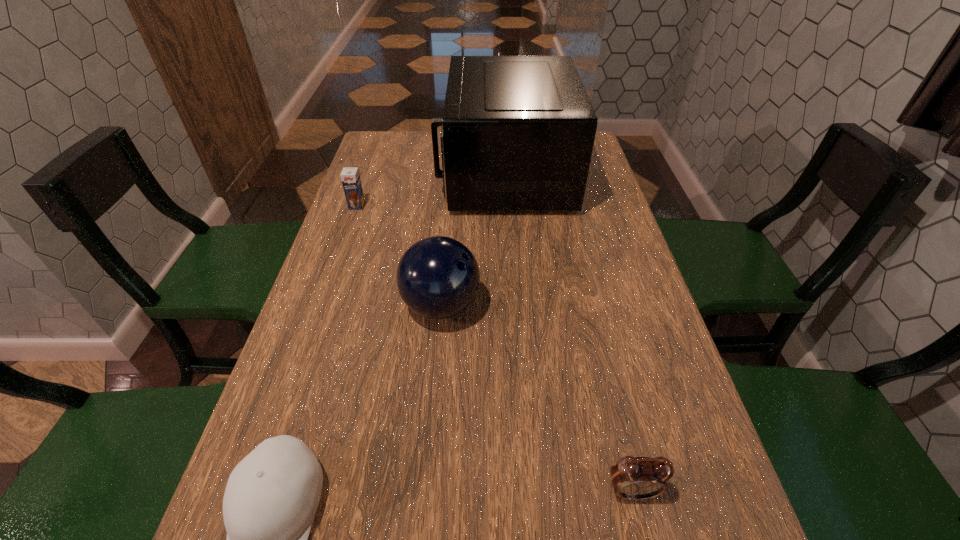
The width and height of the screenshot is (960, 540). Identify the location of microwave_oven. (517, 134).

Locate an element on the screen. the third farthest object is located at coordinates (438, 277).

Where is `the fourth shortest object`? The height and width of the screenshot is (540, 960). the fourth shortest object is located at coordinates (438, 277).

At what (x,y) coordinates should I click in order to perform the action: click on chocolate milk. Please return your answer as a coordinate pair (x, y). Looking at the image, I should click on (350, 177).

This screenshot has width=960, height=540. In order to click on alarm clock in this screenshot , I will do `click(634, 478)`.

What are the coordinates of `vacant region located on the front-facing side of the microwave_oven` in the screenshot? It's located at (407, 174).

Locate an element on the screen. This screenshot has height=540, width=960. blank area located 0.140m on the front-facing side of the microwave_oven is located at coordinates (395, 174).

Where is `blank space located on the front-facing side of the microwave_oven`? The width and height of the screenshot is (960, 540). blank space located on the front-facing side of the microwave_oven is located at coordinates tap(359, 174).

This screenshot has height=540, width=960. In order to click on free location located on the surface of the second tallest object near the finger holes in this screenshot , I will do click(552, 306).

The height and width of the screenshot is (540, 960). Identify the location of vacant space located 0.130m on the front label of the chocolate milk. (346, 239).